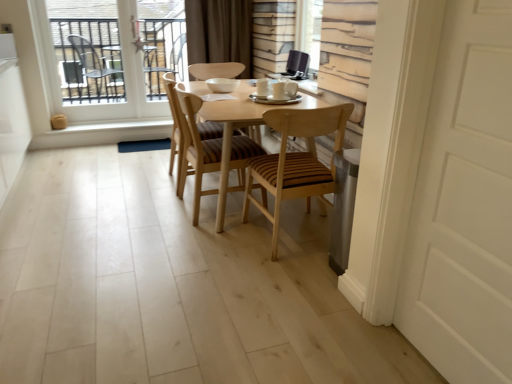
Locate an element on the screen. vacant space to the left of woodenchair at center, the 2th chair from the right is located at coordinates (149, 209).